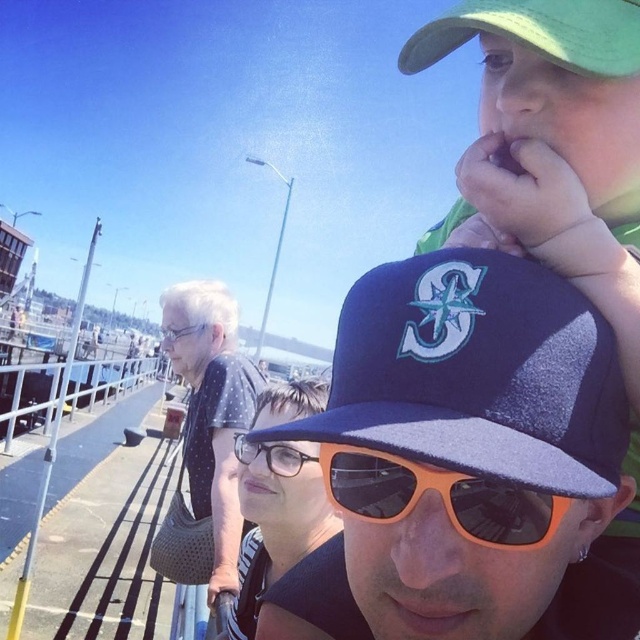
You are standing in the scene and want to take a photo of both the man taking a selfie and the older woman walking away. Which of the two points, point (589,371) or point (472,481), is closer to you?

Point (589,371) is closer to you than point (472,481) because it is further to the camera.

Based on the scene description, which object, the navy blue mesh baseball cap at upper center or the orange plastic sunglasses at center, would block more of the sun if worn by the man?

The navy blue mesh baseball cap at upper center has a larger size compared to orange plastic sunglasses at center, so it would block more of the sun if worn by the man.